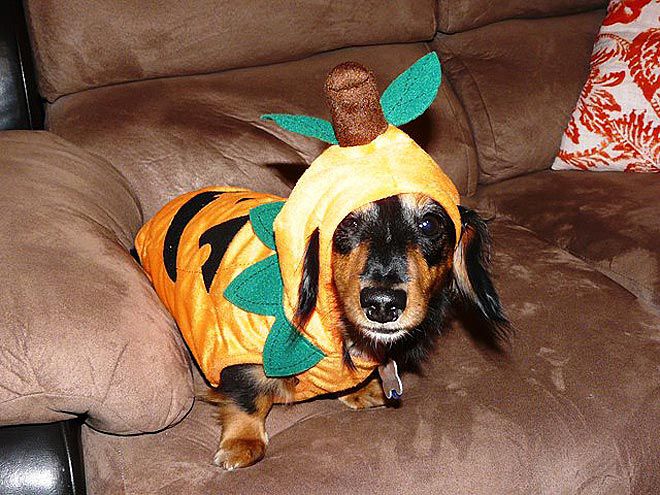
This screenshot has height=495, width=660. What are the coordinates of `right arm rest` in the screenshot? It's located at (55, 238).